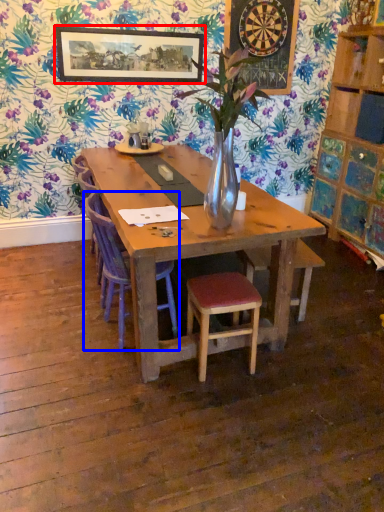
Question: Which object appears closest to the camera in this image, picture frame (highlighted by a red box) or chair (highlighted by a blue box)?

Choices:
 (A) picture frame
 (B) chair

Answer: (B)